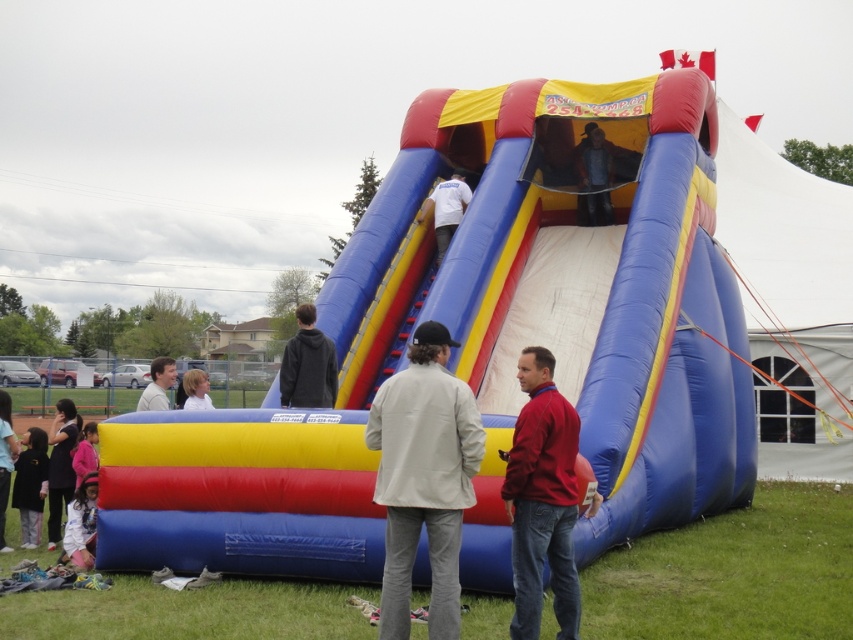
You are organizing a group photo and want to ensure everyone is visible. You notice two people wearing a dark gray hoodie at center and a light pink fleece jacket at lower left. Which person should stand to the left to avoid being blocked by the inflatable slide?

The light pink fleece jacket at lower left should stand to the left because the dark gray hoodie at center is currently positioned to its right, so moving the light pink fleece jacket further left would keep both visible and prevent blocking by the slide.

You are at an outdoor event and see two people wearing the dark gray hoodie at center and the light pink fleece jacket at lower left. Which person is standing closer to the inflatable slide?

The dark gray hoodie at center is positioned over the light pink fleece jacket at lower left, meaning the person in the dark gray hoodie at center is closer to the inflatable slide.